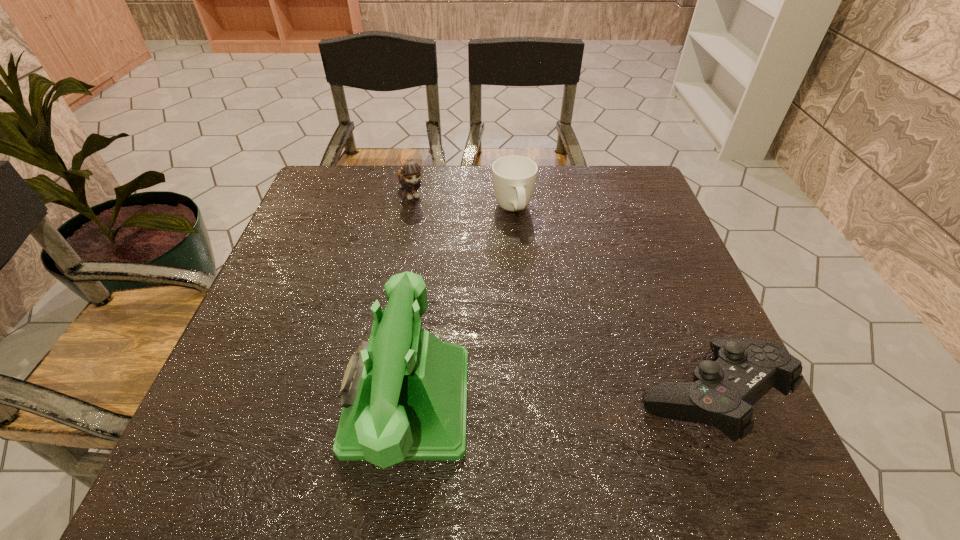
This screenshot has width=960, height=540. In order to click on unoccupied position between the rightmost object and the tallest object in this screenshot , I will do `click(556, 399)`.

I want to click on blank region between the rightmost object and the tallest object, so click(556, 399).

Identify the location of vacant space in between the cup and the kitten. This screenshot has width=960, height=540. (463, 201).

At what (x,y) coordinates should I click in order to perform the action: click on free space between the tallest object and the control. Please return your answer as a coordinate pair (x, y). Looking at the image, I should click on (556, 399).

I want to click on unoccupied position between the telephone and the rightmost object, so click(556, 399).

Select which object appears as the third closest to the third object from left to right. Please provide its 2D coordinates. Your answer should be formatted as a tuple, i.e. [(x, y)], where the tuple contains the x and y coordinates of a point satisfying the conditions above.

[(722, 393)]

Identify which object is the closest to the kitten. Please provide its 2D coordinates. Your answer should be formatted as a tuple, i.e. [(x, y)], where the tuple contains the x and y coordinates of a point satisfying the conditions above.

[(514, 177)]

Where is `vacant area that satisfies the following two spatial constraints: 1. on the front side of the kitten; 2. on the dial of the telephone`? vacant area that satisfies the following two spatial constraints: 1. on the front side of the kitten; 2. on the dial of the telephone is located at coordinates (372, 401).

You are a GUI agent. You are given a task and a screenshot of the screen. Output one action in this format:
    pyautogui.click(x=<x>, y=<y>)
    Task: Click on the vacant point that satisfies the following two spatial constraints: 1. on the front side of the telephone; 2. on the dial of the kitten
    
    Given the screenshot: What is the action you would take?
    pyautogui.click(x=372, y=401)